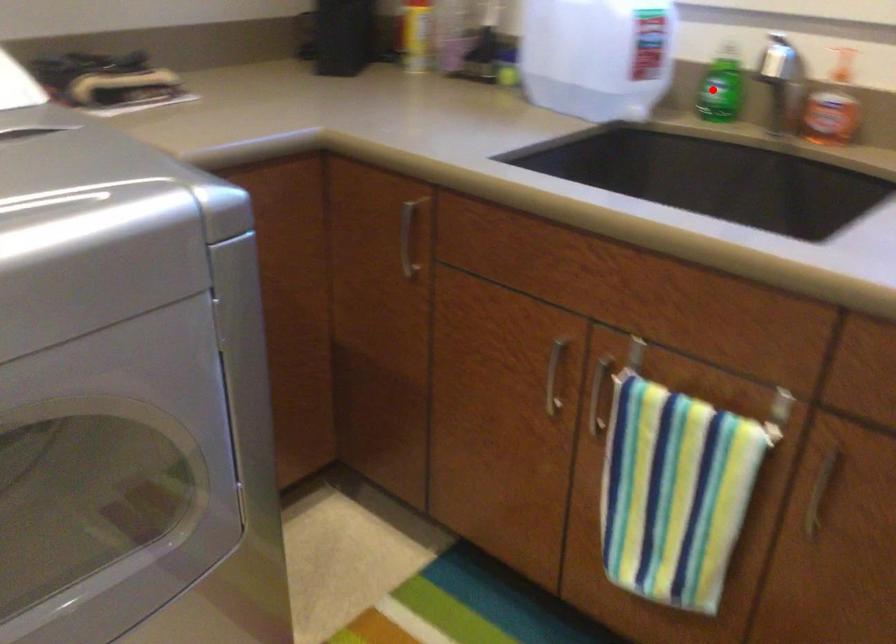
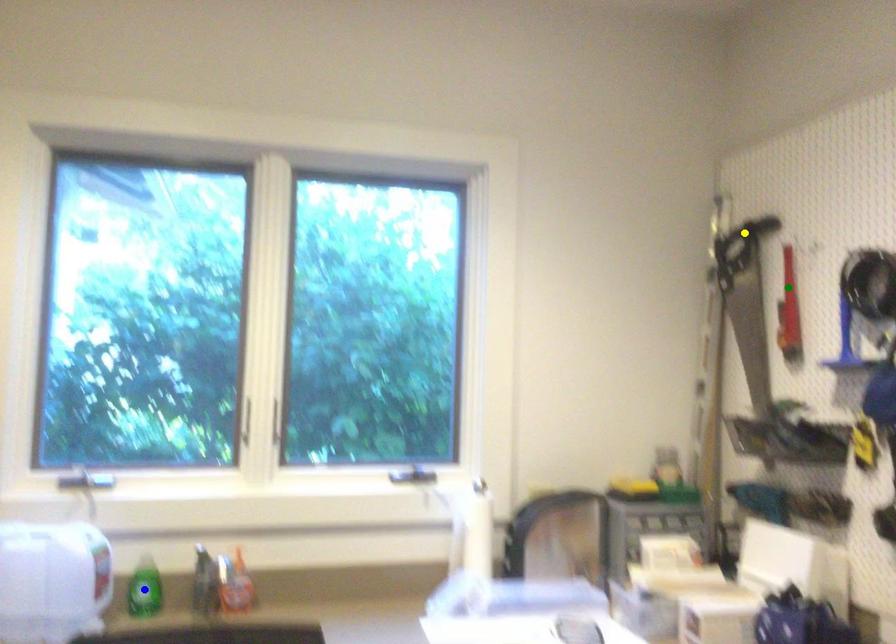
Question: I am providing you with two images of the same scene from different viewpoints. A red point is marked on the first image. You are given multiple points on the second image. Can you choose the point in image 2 that corresponds to the point in image 1?

Choices:
 (A) green point
 (B) blue point
 (C) yellow point

Answer: (B)